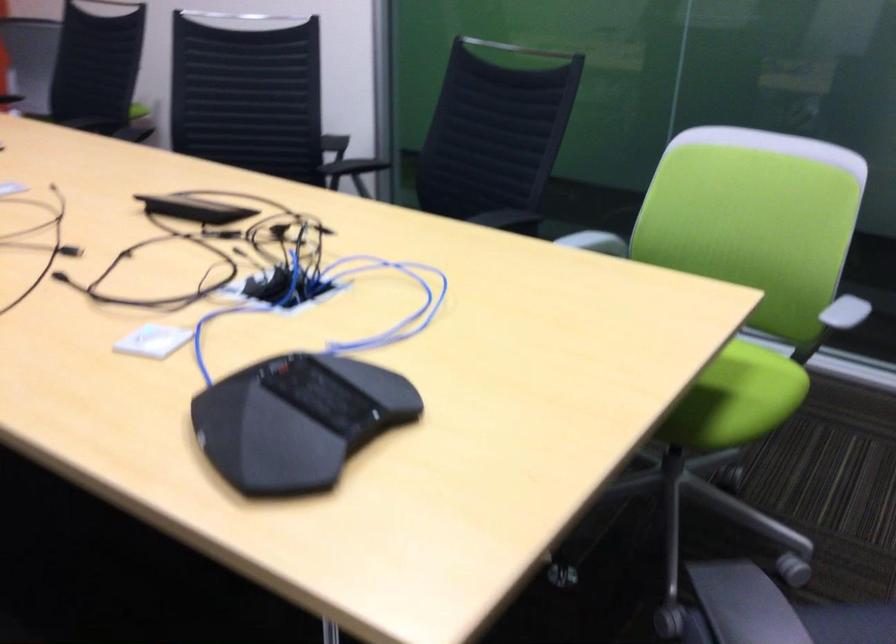
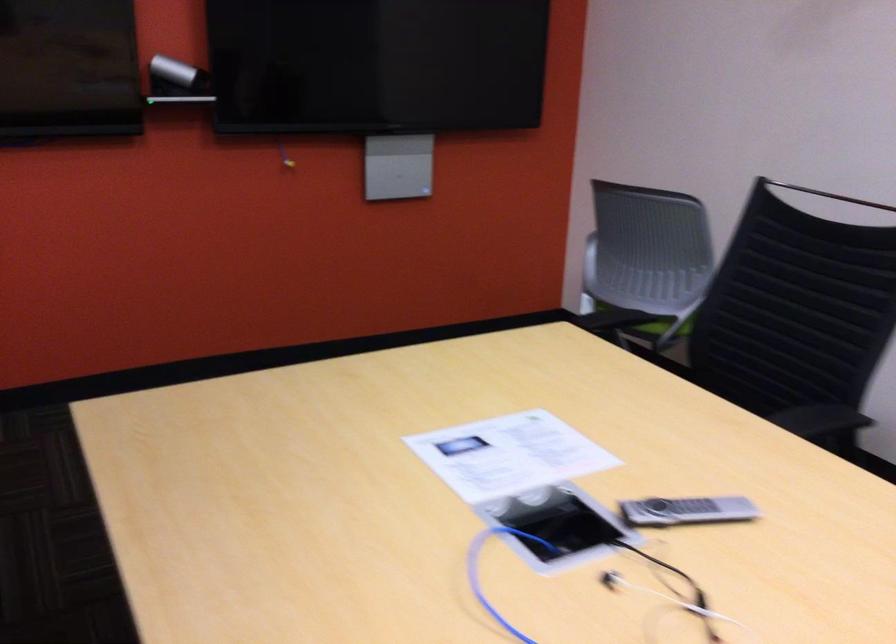
What movement of the cameraman would produce the second image?

The cameraman moved toward left, forward.